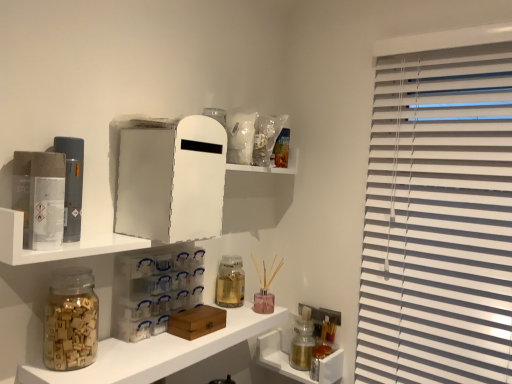
Locate an element on the screen. The width and height of the screenshot is (512, 384). vacant space in front of translucent glass jar at center, which ranks as the second bottle in back-to-front order is located at coordinates (228, 311).